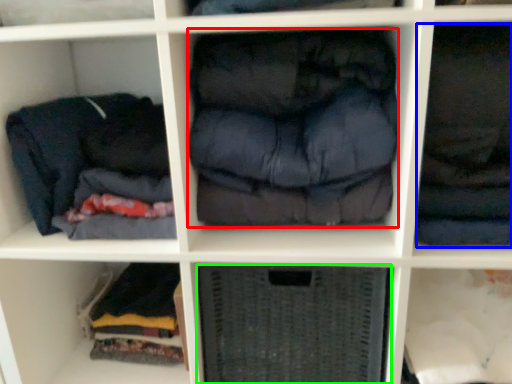
Question: Estimate the real-world distances between objects in this image. Which object is farther from clothing (highlighted by a red box), clothing (highlighted by a blue box) or shelf (highlighted by a green box)?

Choices:
 (A) clothing
 (B) shelf

Answer: (B)